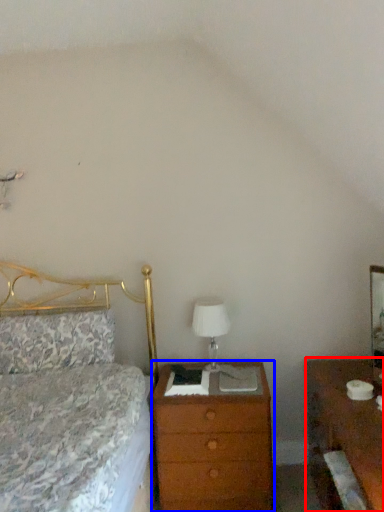
Question: Which object is further to the camera taking this photo, nightstand (highlighted by a red box) or chest of drawers (highlighted by a blue box)?

Choices:
 (A) nightstand
 (B) chest of drawers

Answer: (B)